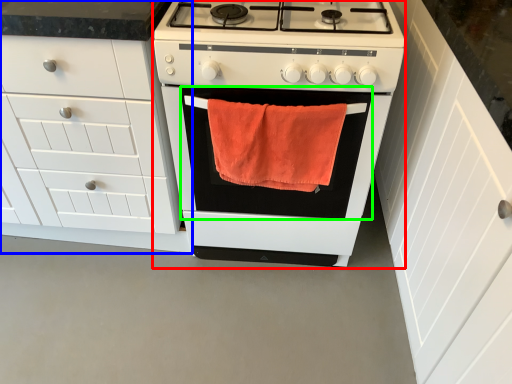
Question: Considering the real-world distances, which object is farthest from appliance (highlighted by a red box)? cabinetry (highlighted by a blue box) or oven (highlighted by a green box)?

Choices:
 (A) cabinetry
 (B) oven

Answer: (A)